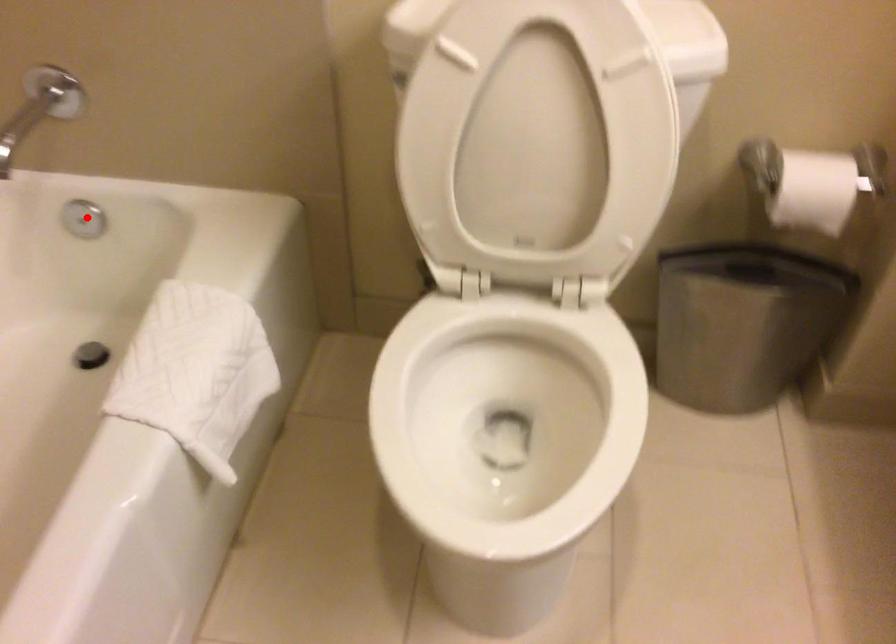
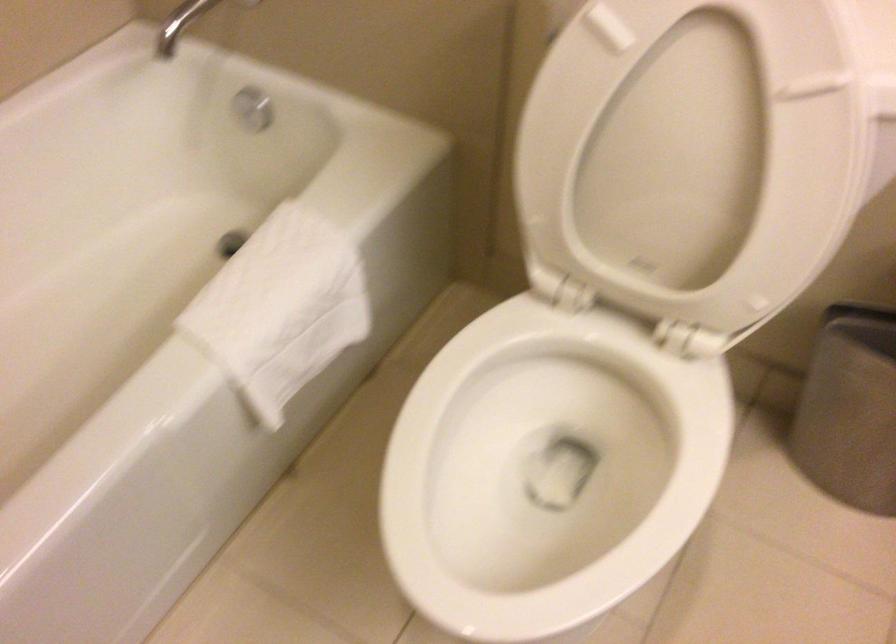
Where in the second image is the point corresponding to the highlighted location from the first image?

(252, 108)